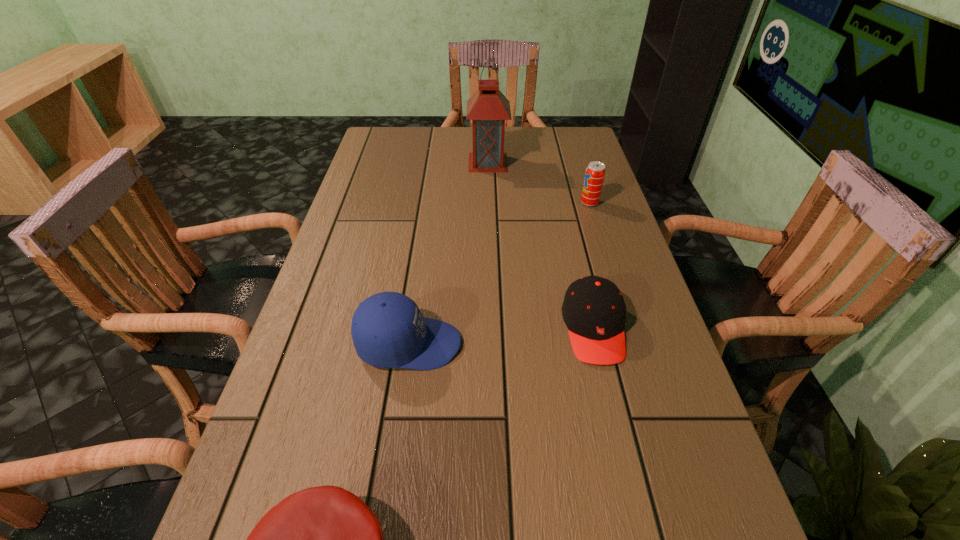
Where is `vacant region that satisfies the following two spatial constraints: 1. on the front-facing side of the rightmost cap; 2. on the front-facing side of the tallest cap`? vacant region that satisfies the following two spatial constraints: 1. on the front-facing side of the rightmost cap; 2. on the front-facing side of the tallest cap is located at coordinates (597, 344).

Where is `vacant area that satisfies the following two spatial constraints: 1. on the front side of the farthest object; 2. on the front-facing side of the tallest cap`? Image resolution: width=960 pixels, height=540 pixels. vacant area that satisfies the following two spatial constraints: 1. on the front side of the farthest object; 2. on the front-facing side of the tallest cap is located at coordinates (492, 344).